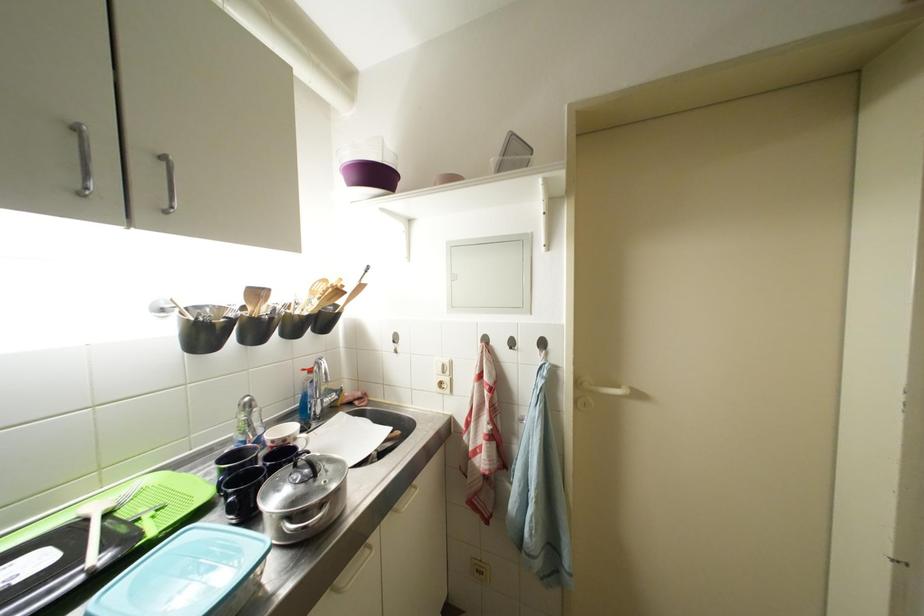
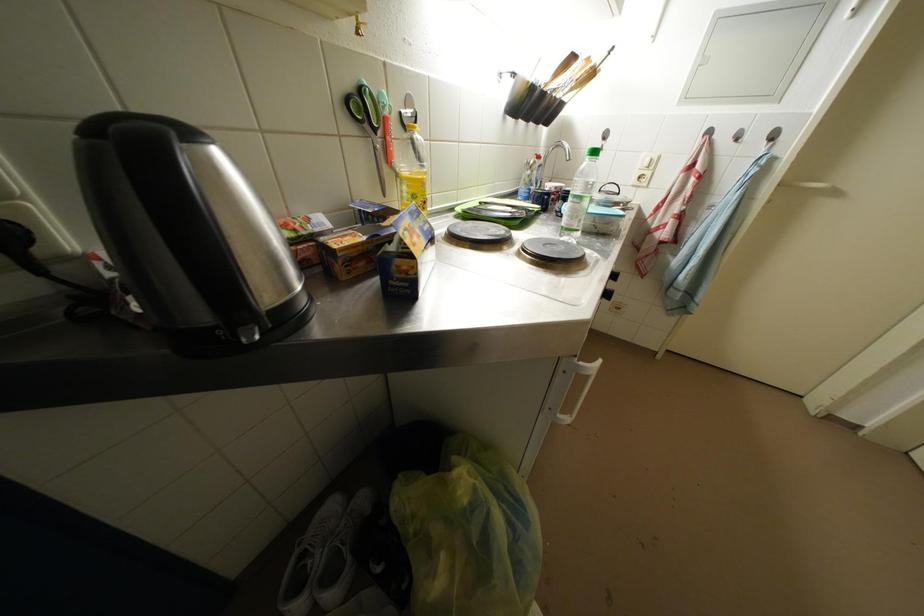
Question: The first image is from the beginning of the video and the second image is from the end. How did the camera likely rotate when shooting the video?

Choices:
 (A) Left
 (B) Right
 (C) Up
 (D) Down

Answer: (D)